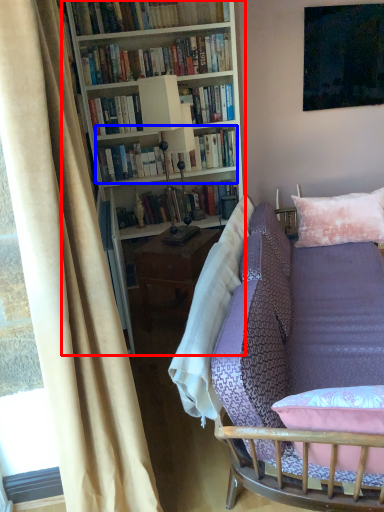
Question: Which object is closer to the camera taking this photo, bookcase (highlighted by a red box) or book (highlighted by a blue box)?

Choices:
 (A) bookcase
 (B) book

Answer: (A)